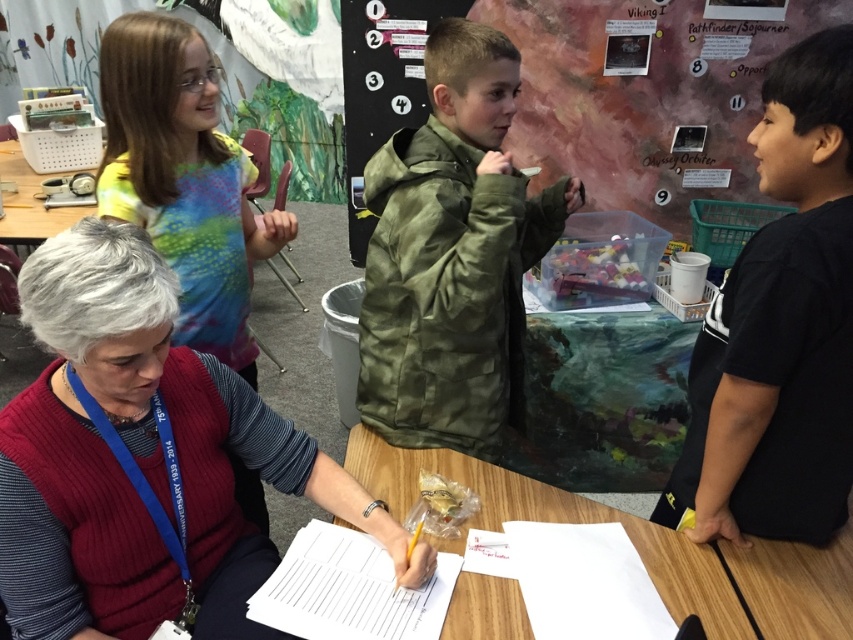
Question: Which object is farther from the camera taking this photo?

Choices:
 (A) maroon sweater at center
 (B) knitted red sweater at upper left
 (C) black matte shirt at right
 (D) white paper at center

Answer: (B)

Question: Does camouflage jacket at center lie behind white paper at center?

Choices:
 (A) no
 (B) yes

Answer: (B)

Question: Which of the following is the farthest from the observer?

Choices:
 (A) (576, 508)
 (B) (206, 317)
 (C) (786, 289)

Answer: (B)

Question: Considering the relative positions of black matte shirt at right and wooden table at center in the image provided, where is black matte shirt at right located with respect to wooden table at center?

Choices:
 (A) right
 (B) left

Answer: (A)

Question: Which point is farther to the camera?

Choices:
 (A) maroon sweater at center
 (B) black matte shirt at right

Answer: (B)

Question: In this image, where is wooden table at center located relative to matte plastic table at left?

Choices:
 (A) above
 (B) below

Answer: (B)